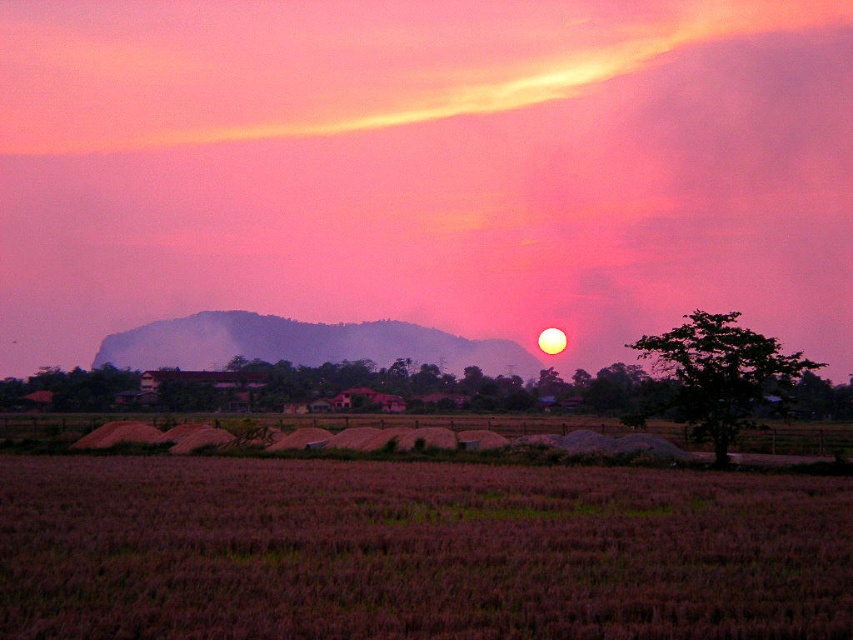
Question: Is pink matte cloud at upper center to the left of dark green leafy tree at right from the viewer's perspective?

Choices:
 (A) yes
 (B) no

Answer: (A)

Question: Based on their relative distances, which object is nearer to the dark green leafy tree at right?

Choices:
 (A) pink matte cloud at upper center
 (B) purple matte rice field at lower center

Answer: (B)

Question: Does pink matte cloud at upper center come in front of dark green leafy tree at right?

Choices:
 (A) no
 (B) yes

Answer: (A)

Question: Which object is closer to the camera taking this photo?

Choices:
 (A) purple matte rice field at lower center
 (B) dark green leafy tree at right

Answer: (A)

Question: Is pink matte cloud at upper center to the right of dark green leafy tree at right from the viewer's perspective?

Choices:
 (A) yes
 (B) no

Answer: (B)

Question: Which point appears farthest from the camera in this image?

Choices:
 (A) (129, 582)
 (B) (762, 374)
 (C) (711, 225)

Answer: (C)